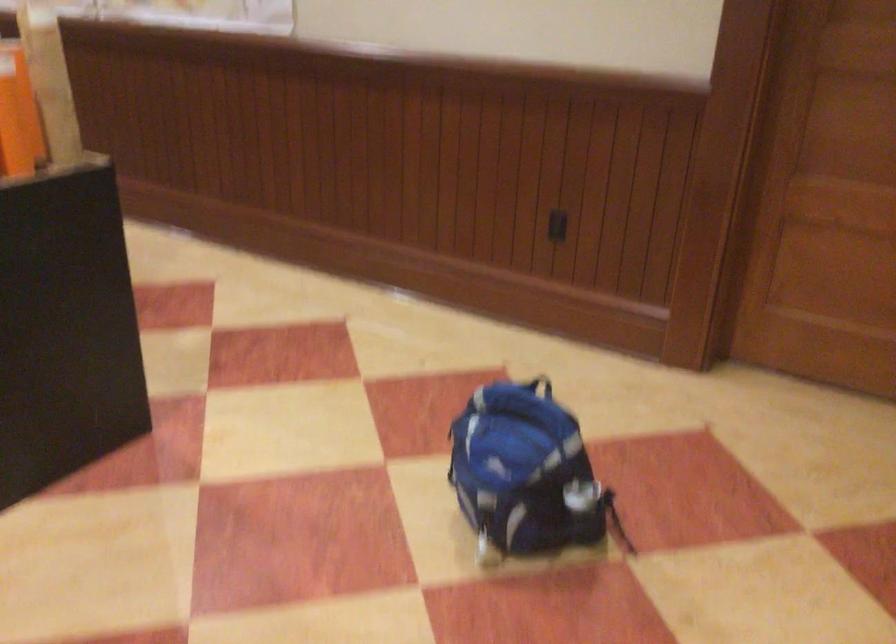
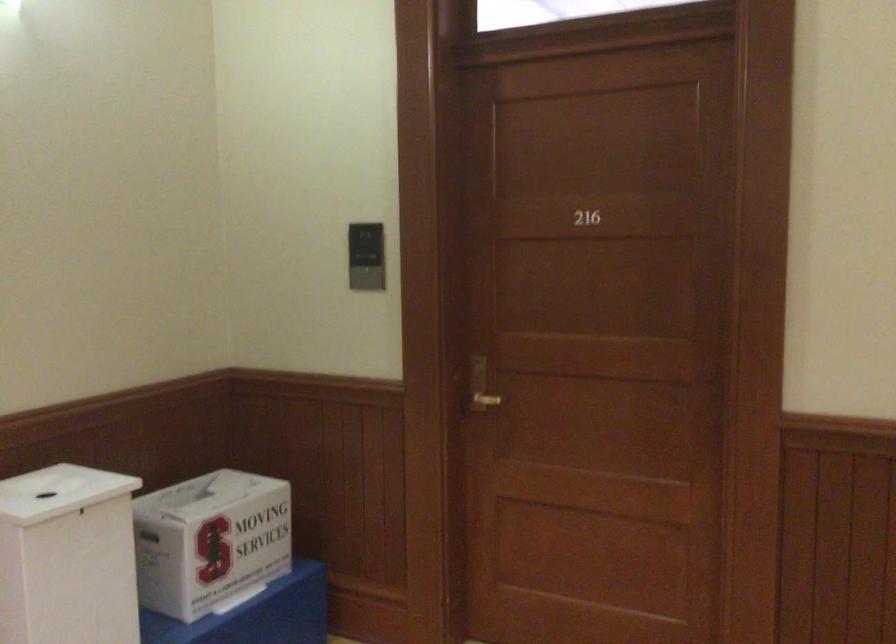
Question: The images are taken continuously from a first-person perspective. In which direction is your viewpoint rotating?

Choices:
 (A) Left
 (B) Right
 (C) Up
 (D) Down

Answer: (B)